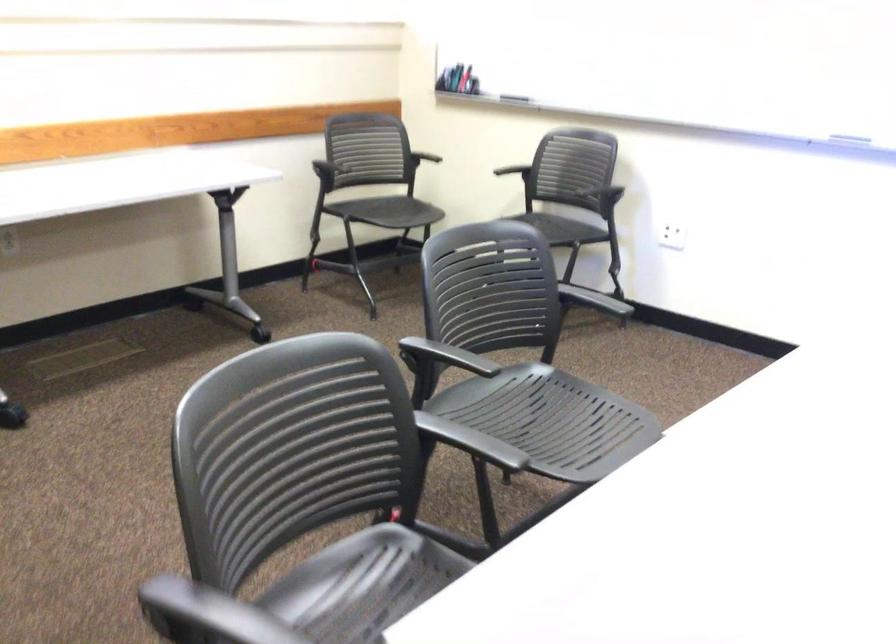
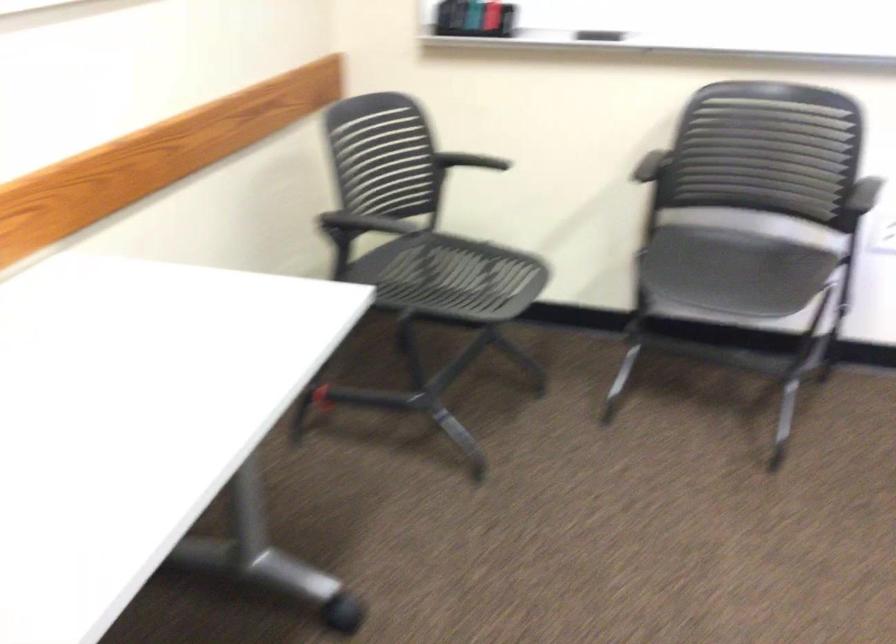
The images are taken continuously from a first-person perspective. In which direction are you moving?

The movement direction of the cameraman is left, forward.